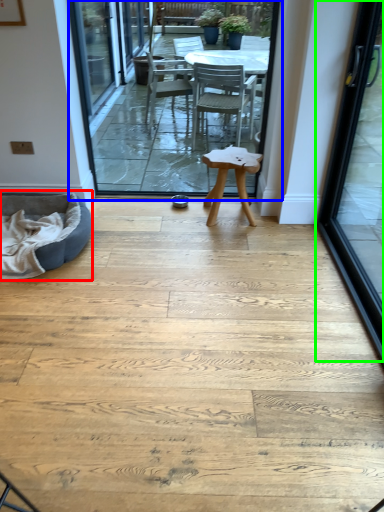
Question: Which is farther away from bean bag chair (highlighted by a red box)? terrace (highlighted by a blue box) or door (highlighted by a green box)?

Choices:
 (A) terrace
 (B) door

Answer: (B)